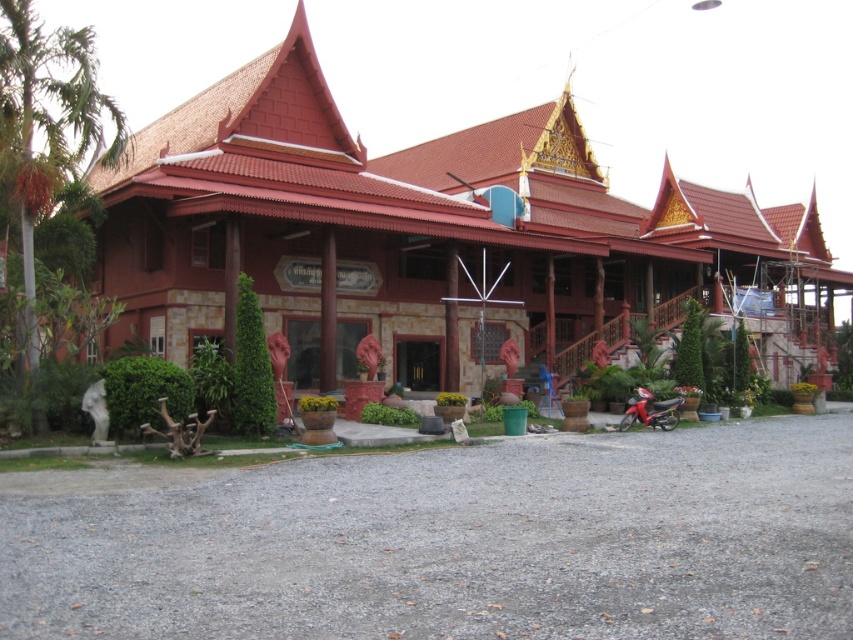
Which is behind, point (74, 116) or point (660, 419)?

The point (660, 419) is more distant.

Does green leafy palm tree at left lie behind metallic red motorcycle at lower right?

No, green leafy palm tree at left is closer to the viewer.

Where is `green leafy palm tree at left`? This screenshot has height=640, width=853. green leafy palm tree at left is located at coordinates (47, 128).